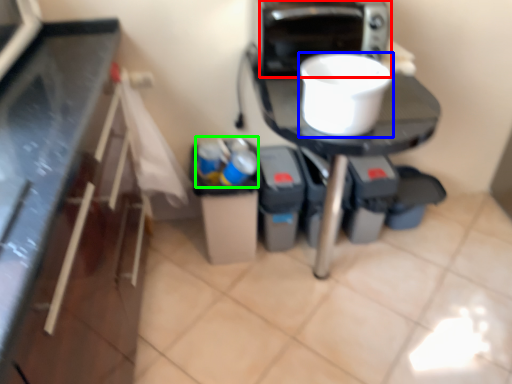
Question: Estimate the real-world distances between objects in this image. Which object is closer to home appliance (highlighted by a red box), kitchen appliance (highlighted by a blue box) or garbage (highlighted by a green box)?

Choices:
 (A) kitchen appliance
 (B) garbage

Answer: (A)